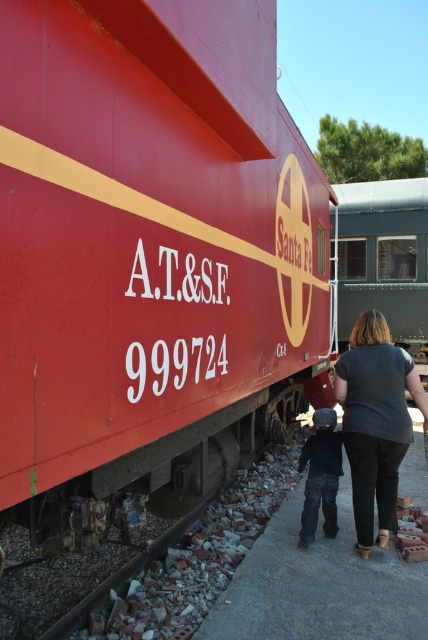
Question: Is matte red train at center thinner than dark gray knit sweater at center?

Choices:
 (A) no
 (B) yes

Answer: (A)

Question: Does matte red train at center appear over dark gray sweater at lower center?

Choices:
 (A) no
 (B) yes

Answer: (B)

Question: Which object appears farthest from the camera in this image?

Choices:
 (A) dark gray knit sweater at center
 (B) dark gray sweater at lower center

Answer: (B)

Question: Which point is farther from the camera taking this photo?

Choices:
 (A) (389, 314)
 (B) (395, 396)

Answer: (A)

Question: In this image, where is matte red train at center located relative to dark gray sweater at lower center?

Choices:
 (A) below
 (B) above

Answer: (B)

Question: Which point is closer to the camera taking this photo?

Choices:
 (A) pos(317,464)
 (B) pos(249,413)

Answer: (A)